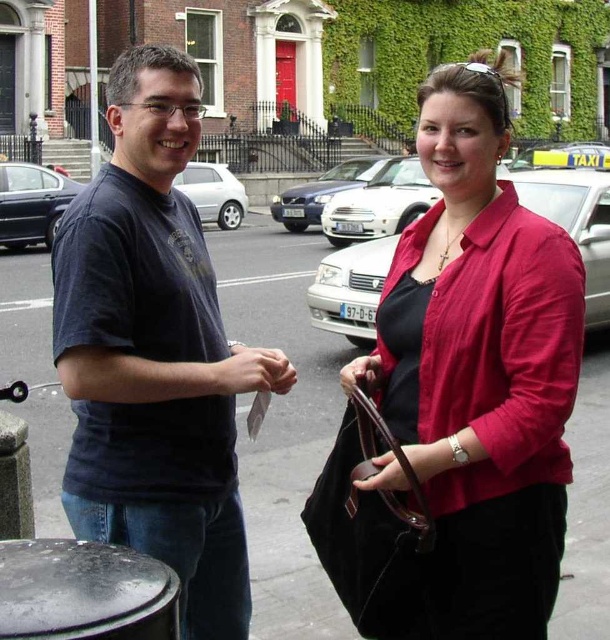
Who is taller, leather handbag at lower center or matte paper money at center?

With more height is leather handbag at lower center.

Is point (384, 470) positioned before point (253, 349)?

Yes, it is.

Which is behind, point (417, 458) or point (285, 378)?

The point (285, 378) is behind.

Find the location of a particular element. leather handbag at lower center is located at coordinates (428, 458).

Describe the element at coordinates (361, 372) in the screenshot. I see `leather at center` at that location.

Does leather at center appear over matte paper money at center?

No.

Between point (371, 358) and point (293, 371), which one is positioned behind?

The point (371, 358) is more distant.

Where is `leather at center`? leather at center is located at coordinates (361, 372).

Measure the distance between matte pink blouse at center and camera.

They are 5.36 meters apart.

At what (x,y) coordinates should I click in order to perform the action: click on matte pink blouse at center. Please return your answer as a coordinate pair (x, y). Image resolution: width=610 pixels, height=640 pixels. Looking at the image, I should click on (483, 365).

Who is more distant from viewer, (553,598) or (443,460)?

The point (553,598) is behind.

Identify the location of matte pink blouse at center. (483, 365).